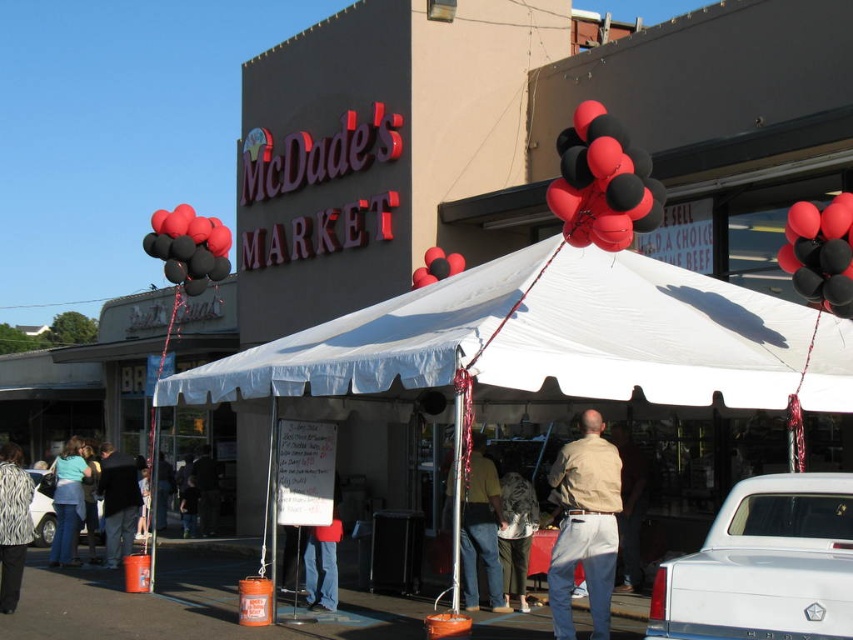
Is zebra print coat at lower left shorter than light blue denim jeans at lower left?

No, zebra print coat at lower left is not shorter than light blue denim jeans at lower left.

Is zebra print coat at lower left further to camera compared to light blue denim jeans at lower left?

That is False.

Is point (1, 566) positioned in front of point (68, 474)?

Yes.

At what (x,y) coordinates should I click in order to perform the action: click on zebra print coat at lower left. Please return your answer as a coordinate pair (x, y). This screenshot has height=640, width=853. Looking at the image, I should click on (13, 524).

Can you confirm if black matte balloons at upper right is positioned above white glossy car at lower left?

Indeed, black matte balloons at upper right is positioned over white glossy car at lower left.

Is black matte balloons at upper right further to camera compared to white glossy car at lower left?

No, black matte balloons at upper right is in front of white glossy car at lower left.

This screenshot has width=853, height=640. In order to click on black matte balloons at upper right in this screenshot , I will do `click(820, 252)`.

Can you confirm if white fabric tent at center is bigger than zebra print coat at lower left?

No, white fabric tent at center is not bigger than zebra print coat at lower left.

Looking at this image, can you confirm if white fabric tent at center is positioned to the right of zebra print coat at lower left?

Yes, white fabric tent at center is to the right of zebra print coat at lower left.

This screenshot has width=853, height=640. Identify the location of white fabric tent at center. (555, 339).